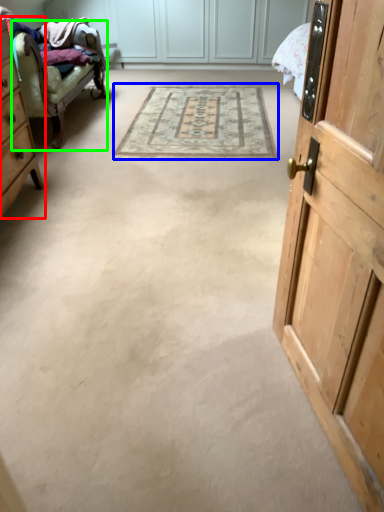
Question: Which object is the farthest from cabinetry (highlighted by a red box)? Choose among these: mat (highlighted by a blue box) or chair (highlighted by a green box).

Choices:
 (A) mat
 (B) chair

Answer: (A)